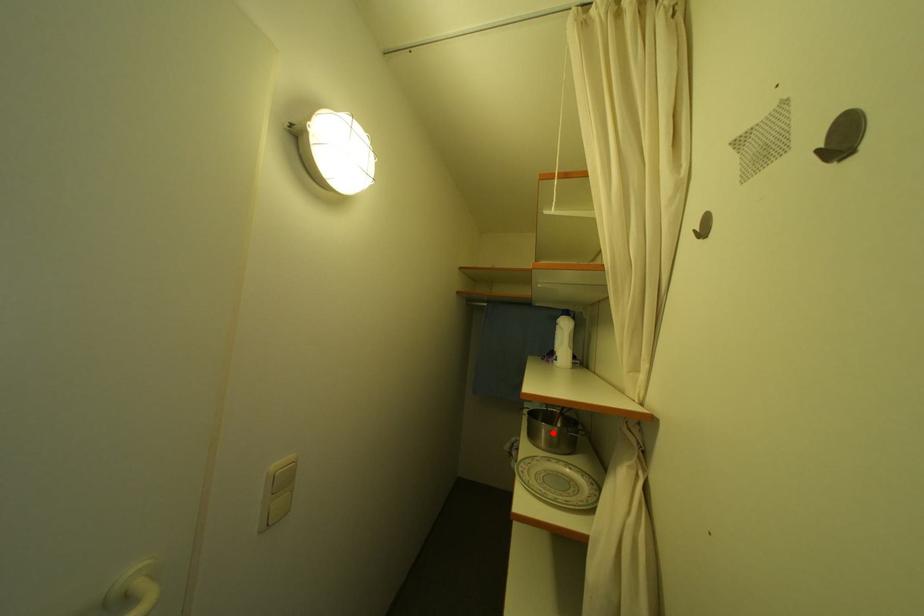
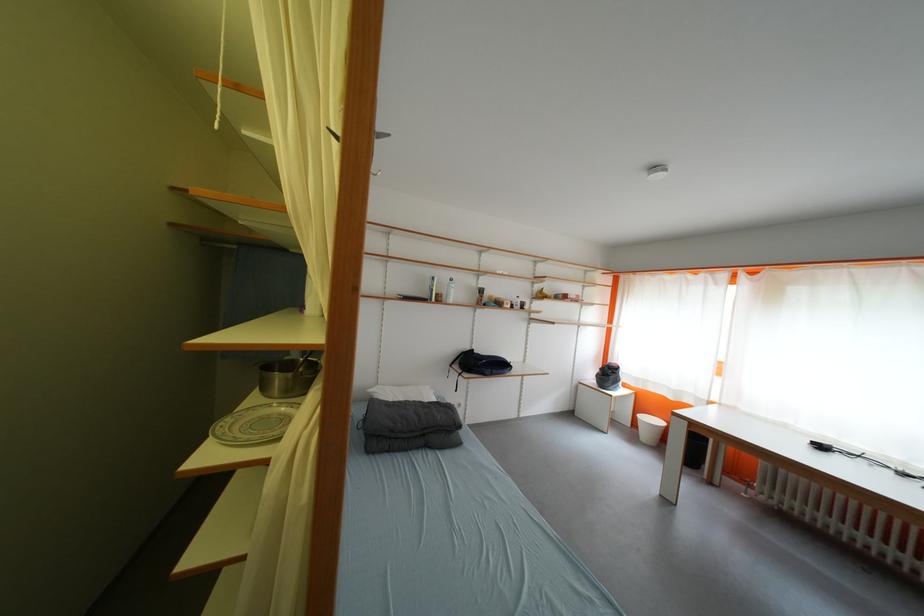
The point at the highlighted location is marked in the first image. Where is the corresponding point in the second image?

(286, 382)